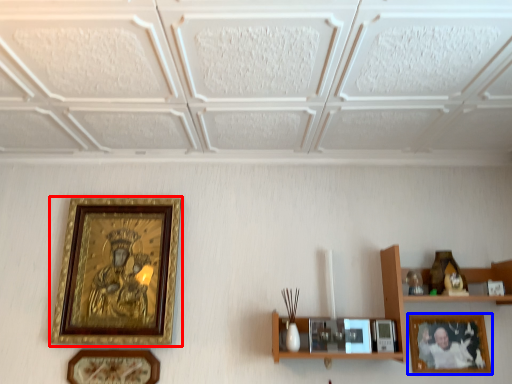
Question: Which object appears farthest to the camera in this image, picture frame (highlighted by a red box) or picture frame (highlighted by a blue box)?

Choices:
 (A) picture frame
 (B) picture frame

Answer: (B)